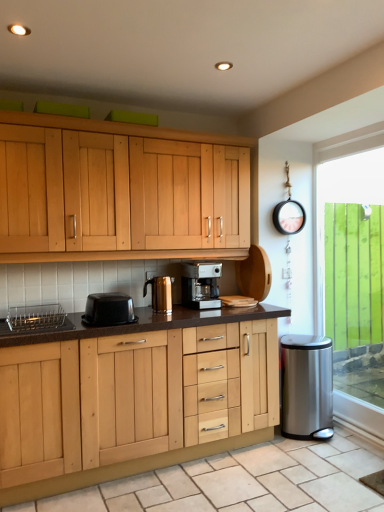
Question: Is black plastic container at center, placed as the 2th kitchen appliance when sorted from right to left, turned away from metallic silver kettle at center, which is the 2th kitchen appliance in front-to-back order?

Choices:
 (A) no
 (B) yes

Answer: (A)

Question: Considering the relative sizes of black plastic container at center, which ranks as the first kitchen appliance in front-to-back order, and metallic silver kettle at center, the first kitchen appliance positioned from the right, in the image provided, is black plastic container at center, which ranks as the first kitchen appliance in front-to-back order, bigger than metallic silver kettle at center, the first kitchen appliance positioned from the right,?

Choices:
 (A) yes
 (B) no

Answer: (A)

Question: Is black plastic container at center, which ranks as the first kitchen appliance in front-to-back order, at the right side of metallic silver kettle at center, which appears as the first kitchen appliance when viewed from the back?

Choices:
 (A) no
 (B) yes

Answer: (A)

Question: Considering the relative sizes of black plastic container at center, placed as the 2th kitchen appliance when sorted from right to left, and metallic silver kettle at center, marked as the second kitchen appliance in a left-to-right arrangement, in the image provided, is black plastic container at center, placed as the 2th kitchen appliance when sorted from right to left, wider than metallic silver kettle at center, marked as the second kitchen appliance in a left-to-right arrangement,?

Choices:
 (A) yes
 (B) no

Answer: (A)

Question: Is black plastic container at center, placed as the 2th kitchen appliance when sorted from right to left, surrounding metallic silver kettle at center, marked as the second kitchen appliance in a left-to-right arrangement?

Choices:
 (A) no
 (B) yes

Answer: (A)

Question: Is point (59, 324) closer or farther from the camera than point (152, 294)?

Choices:
 (A) closer
 (B) farther

Answer: (A)

Question: Is silver metallic dish rack at lower left, which is the first appliance in left-to-right order, in front of or behind metallic silver kettle at center, which is the 2th kitchen appliance in front-to-back order, in the image?

Choices:
 (A) behind
 (B) front

Answer: (B)

Question: Is silver metallic dish rack at lower left, the 1th appliance when ordered from front to back, wider or thinner than metallic silver kettle at center, which appears as the first kitchen appliance when viewed from the back?

Choices:
 (A) thin
 (B) wide

Answer: (B)

Question: From the image's perspective, relative to metallic silver kettle at center, which appears as the first kitchen appliance when viewed from the back, is silver metallic dish rack at lower left, the 1th appliance when ordered from front to back, above or below?

Choices:
 (A) below
 (B) above

Answer: (A)

Question: Is silver metallic dish rack at lower left, which is the 2th appliance from back to front, taller or shorter than stainless steel trash can at right, marked as the 1th appliance in a back-to-front arrangement?

Choices:
 (A) tall
 (B) short

Answer: (B)

Question: Choose the correct answer: Is silver metallic dish rack at lower left, which is the 2th appliance from back to front, inside stainless steel trash can at right, placed as the second appliance when sorted from top to bottom, or outside it?

Choices:
 (A) inside
 (B) outside

Answer: (B)

Question: Is silver metallic dish rack at lower left, acting as the second appliance starting from the right, in front of or behind stainless steel trash can at right, marked as the 1th appliance in a back-to-front arrangement, in the image?

Choices:
 (A) front
 (B) behind

Answer: (A)

Question: From a real-world perspective, is silver metallic dish rack at lower left, marked as the 2th appliance in a bottom-to-top arrangement, physically located above or below stainless steel trash can at right, placed as the second appliance when sorted from top to bottom?

Choices:
 (A) below
 (B) above

Answer: (B)

Question: Choose the correct answer: Is black plastic container at center, which ranks as the first kitchen appliance in left-to-right order, inside stainless steel trash can at right, marked as the 1th appliance in a back-to-front arrangement, or outside it?

Choices:
 (A) inside
 (B) outside

Answer: (B)

Question: Is point (84, 323) positioned closer to the camera than point (286, 343)?

Choices:
 (A) closer
 (B) farther

Answer: (A)